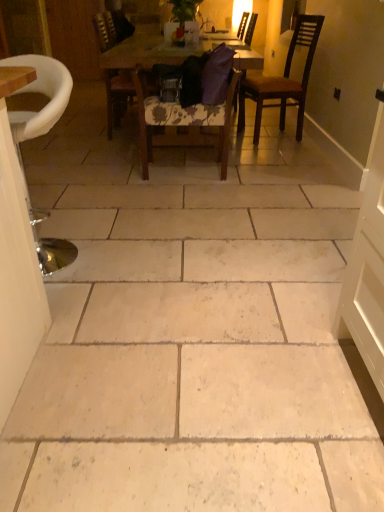
Find the location of `empty space that is to the right of metallic silver stool at left, which is the 5th chair from back to front`. empty space that is to the right of metallic silver stool at left, which is the 5th chair from back to front is located at coordinates (130, 255).